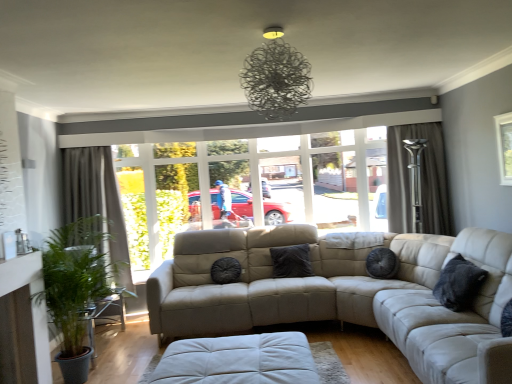
Question: Relative to black textured pillow at center, the second pillow from the back, is dark gray textured curtain at left, which is the 2th curtain in right-to-left order, in front or behind?

Choices:
 (A) behind
 (B) front

Answer: (A)

Question: Visually, is dark gray textured curtain at left, which is the 2th curtain in right-to-left order, positioned to the left or to the right of black textured pillow at center, acting as the 1th pillow starting from the left?

Choices:
 (A) right
 (B) left

Answer: (B)

Question: Estimate the real-world distances between objects in this image. Which object is closer to the matte beige couch at center?

Choices:
 (A) black textured pillow at center, the second pillow from the back
 (B) dark gray fabric curtain at right, the 2th curtain when ordered from left to right
 (C) leather couch at right
 (D) green leafy plant at left
 (E) dark gray textured pillow at right, the third pillow when ordered from back to front

Answer: (B)

Question: Considering the real-world distances, which object is farthest from the metallic wire chandelier at upper center?

Choices:
 (A) green leafy plant at left
 (B) leather couch at right
 (C) white leather footrest at lower center
 (D) matte beige couch at center
 (E) dark gray textured curtain at left, which is the 2th curtain in right-to-left order

Answer: (E)